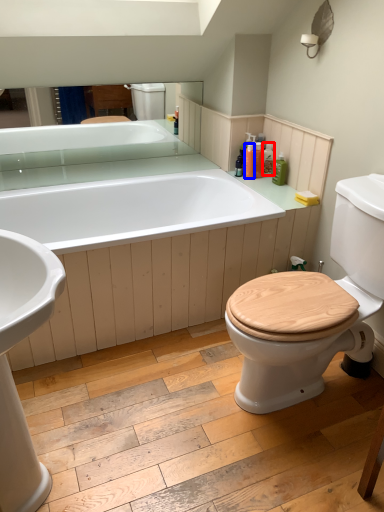
Question: Which of the following is the farthest to the observer, toiletry (highlighted by a red box) or toiletry (highlighted by a blue box)?

Choices:
 (A) toiletry
 (B) toiletry

Answer: (A)